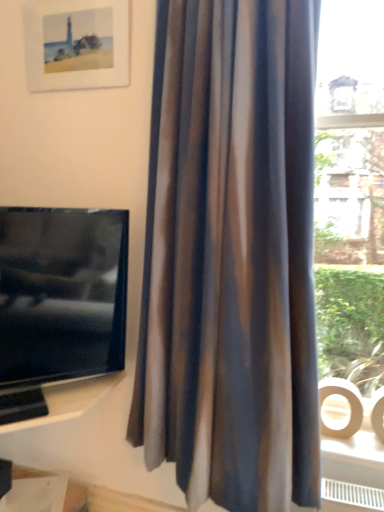
What do you see at coordinates (231, 256) in the screenshot? This screenshot has height=512, width=384. I see `silky brown curtain at center` at bounding box center [231, 256].

Where is `white glossy shelf at lower left`? white glossy shelf at lower left is located at coordinates [x=69, y=400].

How much distance is there between matte black tv at left and white glossy shelf at lower left?

A distance of 8.28 inches exists between matte black tv at left and white glossy shelf at lower left.

From the image's perspective, is matte black tv at left under white glossy shelf at lower left?

Incorrect, from the image's perspective, matte black tv at left is higher than white glossy shelf at lower left.

Is white glossy shelf at lower left at the back of matte black tv at left?

No, matte black tv at left is not facing away from white glossy shelf at lower left.

Is matte black tv at left positioned beyond the bounds of white glossy shelf at lower left?

Yes, matte black tv at left is not within white glossy shelf at lower left.

Which of these two, silky brown curtain at center or white glossy shelf at lower left, stands taller?

silky brown curtain at center.

From the image's perspective, which is below, silky brown curtain at center or white glossy shelf at lower left?

white glossy shelf at lower left, from the image's perspective.

From a real-world perspective, is silky brown curtain at center located higher than white glossy shelf at lower left?

Indeed, from a real-world perspective, silky brown curtain at center stands above white glossy shelf at lower left.

Does silky brown curtain at center have a lesser width compared to white glossy shelf at lower left?

Incorrect, the width of silky brown curtain at center is not less than that of white glossy shelf at lower left.

In the scene shown: Is white glossy shelf at lower left turned away from matte black tv at left?

That's not correct — white glossy shelf at lower left is not looking away from matte black tv at left.

Which of these two, white glossy shelf at lower left or matte black tv at left, is thinner?

matte black tv at left.

Who is shorter, white glossy shelf at lower left or matte black tv at left?

white glossy shelf at lower left.

Considering the points (47, 388) and (27, 355), which point is in front, point (47, 388) or point (27, 355)?

Positioned in front is point (27, 355).

This screenshot has width=384, height=512. Find the location of `television on the left of silky brown curtain at center`. television on the left of silky brown curtain at center is located at coordinates (59, 301).

Which of these two, silky brown curtain at center or matte black tv at left, is wider?

silky brown curtain at center is wider.

Can you see silky brown curtain at center touching matte black tv at left?

No, silky brown curtain at center is not touching matte black tv at left.

Looking at this image, is matte black tv at left completely or partially inside silky brown curtain at center?

No, matte black tv at left is located outside of silky brown curtain at center.

Which is closer to the camera, (63,336) or (288,493)?

Point (63,336) is farther from the camera than point (288,493).

Considering their positions, is matte black tv at left located in front of or behind silky brown curtain at center?

matte black tv at left is positioned farther from the viewer than silky brown curtain at center.

Identify the location of television directly beneath the silky brown curtain at center (from a real-world perspective). (59, 301).

Considering the sizes of objects matte black tv at left and silky brown curtain at center in the image provided, who is wider, matte black tv at left or silky brown curtain at center?

silky brown curtain at center is wider.

Is silky brown curtain at center surrounding matte paper picture frame at upper left?

No.

Which object is thinner, silky brown curtain at center or matte paper picture frame at upper left?

With smaller width is matte paper picture frame at upper left.

Is the position of silky brown curtain at center less distant than that of matte paper picture frame at upper left?

Yes.

Does point (174, 131) lie behind point (37, 24)?

No, it is in front of (37, 24).

Can you tell me how much matte paper picture frame at upper left and white glossy shelf at lower left differ in facing direction?

matte paper picture frame at upper left and white glossy shelf at lower left are facing 45 degrees away from each other.

Is point (54, 22) closer to camera compared to point (72, 398)?

That is False.

Is matte paper picture frame at upper left aimed at white glossy shelf at lower left?

No, matte paper picture frame at upper left is not turned towards white glossy shelf at lower left.

Is matte paper picture frame at upper left touching white glossy shelf at lower left?

No, matte paper picture frame at upper left is not beside white glossy shelf at lower left.

Identify the location of television above the white glossy shelf at lower left (from the image's perspective). (59, 301).

Locate an element on the screen. This screenshot has height=512, width=384. shelf behind the silky brown curtain at center is located at coordinates (69, 400).

Considering their positions, is white glossy shelf at lower left positioned closer to matte black tv at left than silky brown curtain at center?

white glossy shelf at lower left is positioned closer to the anchor matte black tv at left.

When comparing their distances from matte black tv at left, does silky brown curtain at center or matte paper picture frame at upper left seem closer?

silky brown curtain at center.

Based on their spatial positions, is matte paper picture frame at upper left or silky brown curtain at center closer to white glossy shelf at lower left?

silky brown curtain at center is positioned closer to the anchor white glossy shelf at lower left.

Considering their positions, is matte paper picture frame at upper left positioned closer to matte black tv at left than silky brown curtain at center?

silky brown curtain at center is positioned closer to the anchor matte black tv at left.

Based on their spatial positions, is matte black tv at left or matte paper picture frame at upper left closer to white glossy shelf at lower left?

matte black tv at left.

Estimate the real-world distances between objects in this image. Which object is closer to silky brown curtain at center, matte black tv at left or matte paper picture frame at upper left?

The object closer to silky brown curtain at center is matte black tv at left.

Consider the image. Considering their positions, is white glossy shelf at lower left positioned further to silky brown curtain at center than matte paper picture frame at upper left?

matte paper picture frame at upper left lies further to silky brown curtain at center than the other object.

Estimate the real-world distances between objects in this image. Which object is further from silky brown curtain at center, matte black tv at left or white glossy shelf at lower left?

The object further to silky brown curtain at center is white glossy shelf at lower left.

Identify the location of curtain between matte paper picture frame at upper left and white glossy shelf at lower left in the up-down direction. (231, 256).

Find the location of a particular element. The image size is (384, 512). television between matte paper picture frame at upper left and white glossy shelf at lower left vertically is located at coordinates (59, 301).

Locate an element on the screen. curtain between matte paper picture frame at upper left and matte black tv at left from top to bottom is located at coordinates (231, 256).

This screenshot has width=384, height=512. Find the location of `television located between white glossy shelf at lower left and silky brown curtain at center in the left-right direction`. television located between white glossy shelf at lower left and silky brown curtain at center in the left-right direction is located at coordinates (59, 301).